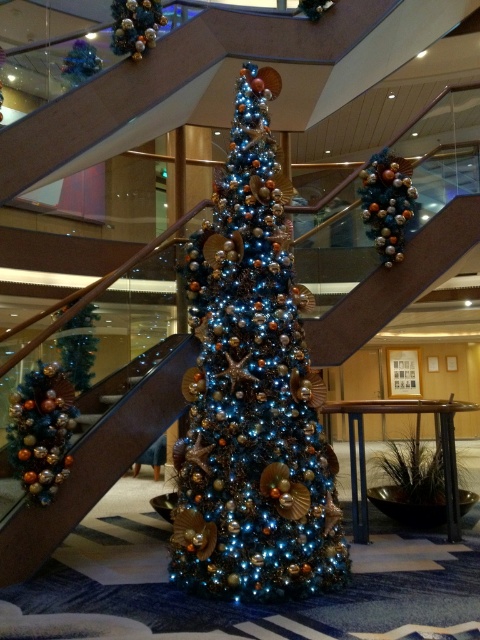
You are a guest at the hotel and want to take a photo of the green matte christmas tree at left and the metallic blue ornament at upper left. Which object should you focus on first if you want to capture both in a single frame without moving the camera?

You should focus on the metallic blue ornament at upper left first because it is wider than the green matte christmas tree at left, so it will occupy more space in the frame.

You are standing at the base of the Christmas tree and want to hang a new ornament. You notice the shiny metallic garland at left and the metallic gold ornament at upper center. Which object is closer to you?

The shiny metallic garland at left is closer to you because it is in front of the metallic gold ornament at upper center.

You are a guest at the hotel and want to take a photo of the green matte christmas tree at left and the metallic blue ornament at upper left. Which object should you focus on first to ensure both are in frame without moving the camera?

You should focus on the metallic blue ornament at upper left first because the green matte christmas tree at left is taller than the metallic blue ornament at upper left, so adjusting the camera to include the taller tree will automatically include the shorter ornament in the frame.